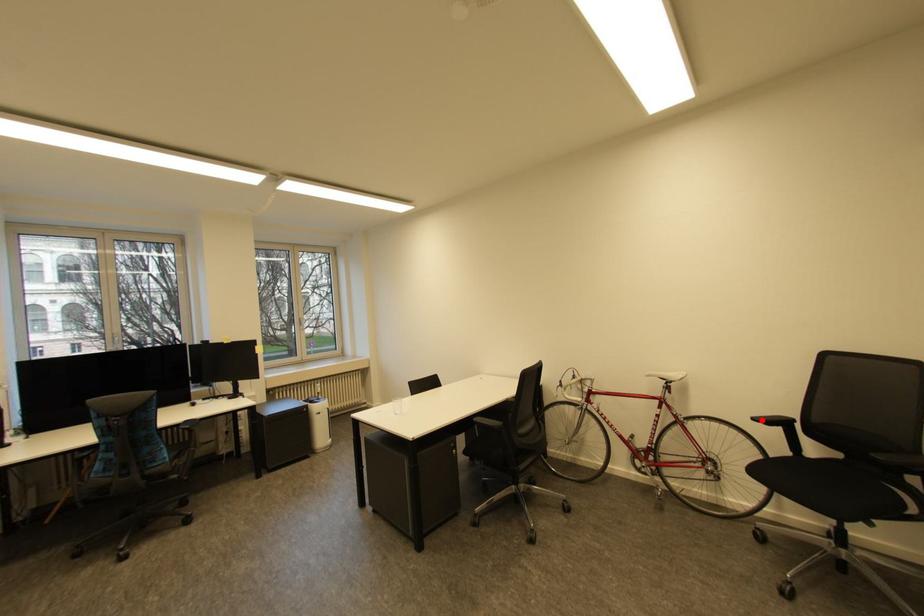
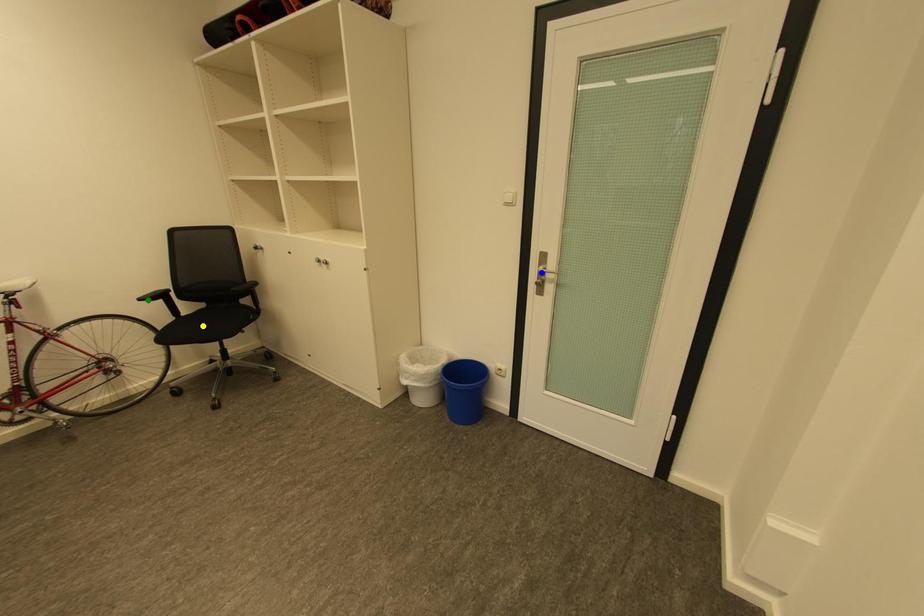
Question: I am providing you with two images of the same scene from different viewpoints. A red point is marked on the first image. You are given multiple points on the second image. In image 2, which mark is for the same physical point as the one in image 1?

Choices:
 (A) green point
 (B) blue point
 (C) yellow point

Answer: (A)